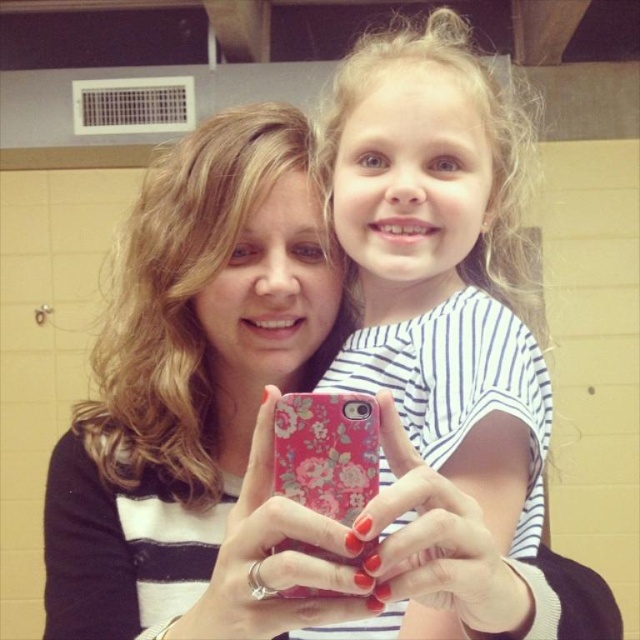
This screenshot has width=640, height=640. Find the location of `matte black shirt at center`. matte black shirt at center is located at coordinates (188, 372).

The width and height of the screenshot is (640, 640). What do you see at coordinates (188, 372) in the screenshot? I see `matte black shirt at center` at bounding box center [188, 372].

Image resolution: width=640 pixels, height=640 pixels. Find the location of `matte black shirt at center`. matte black shirt at center is located at coordinates (188, 372).

Is point (417, 113) in front of point (310, 464)?

No, (417, 113) is behind (310, 464).

Find the location of a particular element. This screenshot has width=640, height=640. white striped shirt at upper center is located at coordinates (448, 284).

Can you confirm if matte black shirt at center is wider than white striped shirt at upper center?

Correct, the width of matte black shirt at center exceeds that of white striped shirt at upper center.

Does matte black shirt at center have a lesser width compared to white striped shirt at upper center?

No, matte black shirt at center is not thinner than white striped shirt at upper center.

The width and height of the screenshot is (640, 640). Describe the element at coordinates (188, 372) in the screenshot. I see `matte black shirt at center` at that location.

Locate an element on the screen. The width and height of the screenshot is (640, 640). matte black shirt at center is located at coordinates (188, 372).